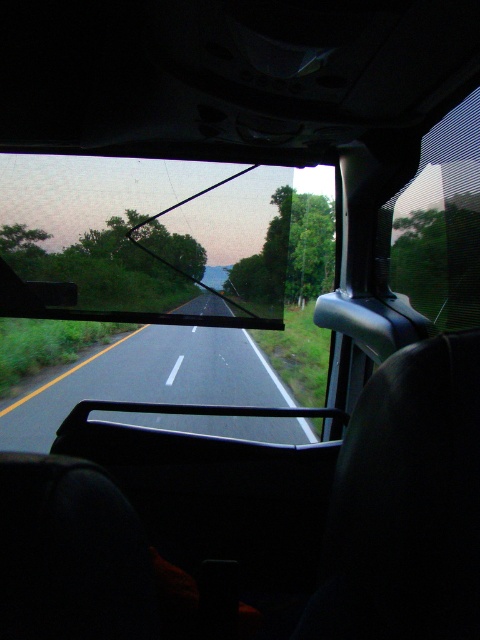
You are a passenger in a vehicle and want to look outside. Which object, the transparent glass windshield at center or the transparent mesh car window at right, allows you to see a wider area of the road ahead?

The transparent glass windshield at center is taller than the transparent mesh car window at right, so it allows you to see a wider area of the road ahead.

You are a passenger in a vehicle and want to look at the road ahead. Which object, the transparent glass windshield at center or the transparent mesh car window at right, provides a clearer view of the road ahead?

The transparent glass windshield at center provides a clearer view of the road ahead because it is located above the transparent mesh car window at right, which might be obstructed or less clear due to its position.

You are a passenger in a vehicle and want to look outside through the transparent glass windshield at center and the transparent mesh car window at right. Which window is located more to the left side?

The transparent glass windshield at center is positioned on the left side of the transparent mesh car window at right, so it is more to the left.